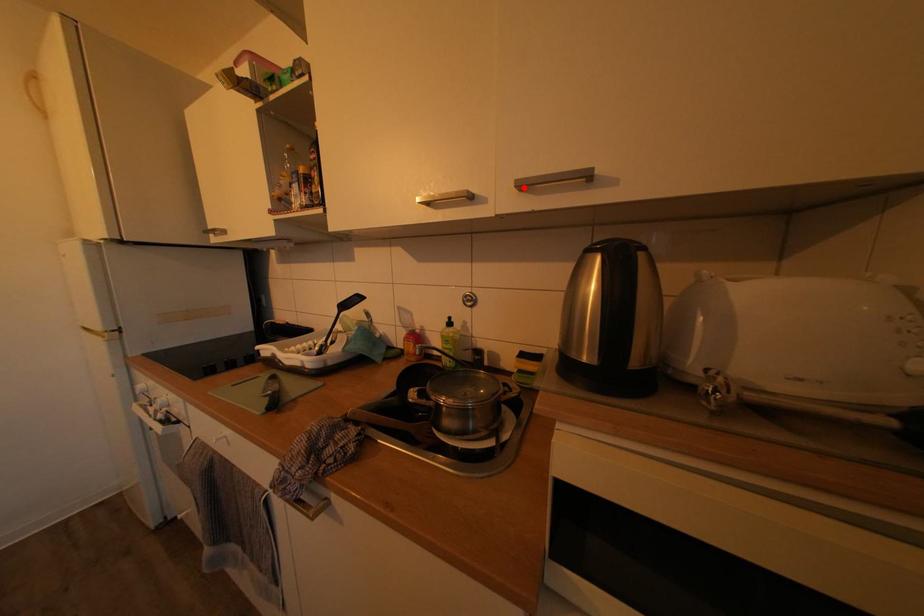
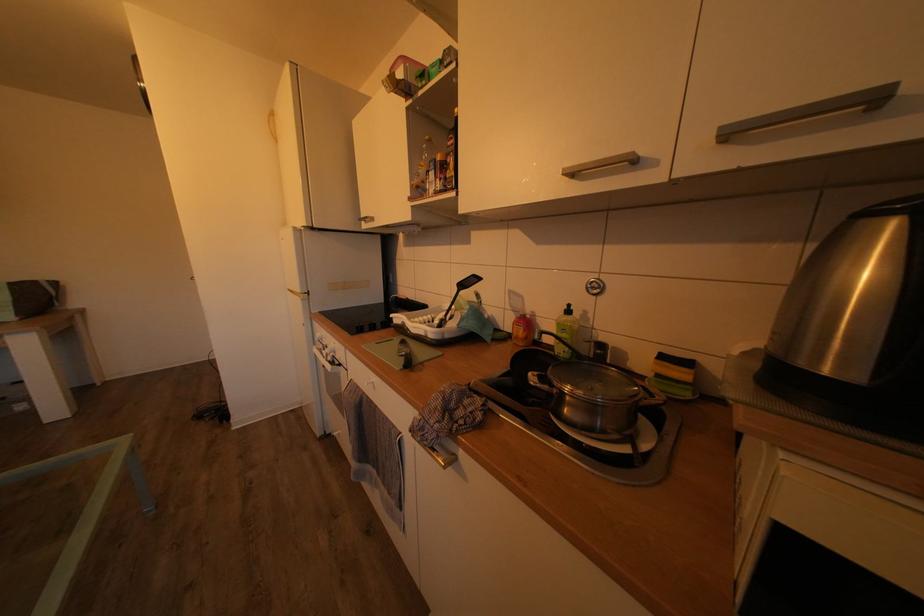
Where in the second image is the point corresponding to the highlighted location from the first image?

(728, 134)